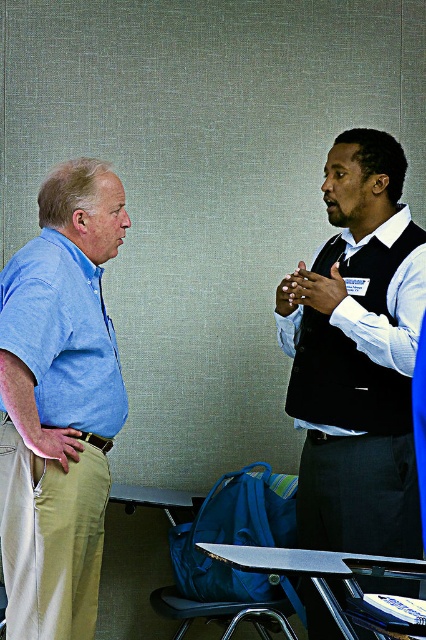
Question: Can you confirm if black vest at center is positioned to the left of white glossy shirt at center?

Choices:
 (A) no
 (B) yes

Answer: (A)

Question: Is khaki pants at left further to the viewer compared to white glossy shirt at center?

Choices:
 (A) no
 (B) yes

Answer: (A)

Question: Among these objects, which one is nearest to the camera?

Choices:
 (A) white glossy shirt at center
 (B) khaki pants at left

Answer: (B)

Question: Does black vest at center appear under khaki pants at left?

Choices:
 (A) no
 (B) yes

Answer: (A)

Question: Among these points, which one is nearest to the camera?

Choices:
 (A) [x=354, y=448]
 (B) [x=46, y=461]
 (C) [x=291, y=340]

Answer: (B)

Question: Which point is closer to the camera?

Choices:
 (A) white glossy shirt at center
 (B) khaki pants at left

Answer: (B)